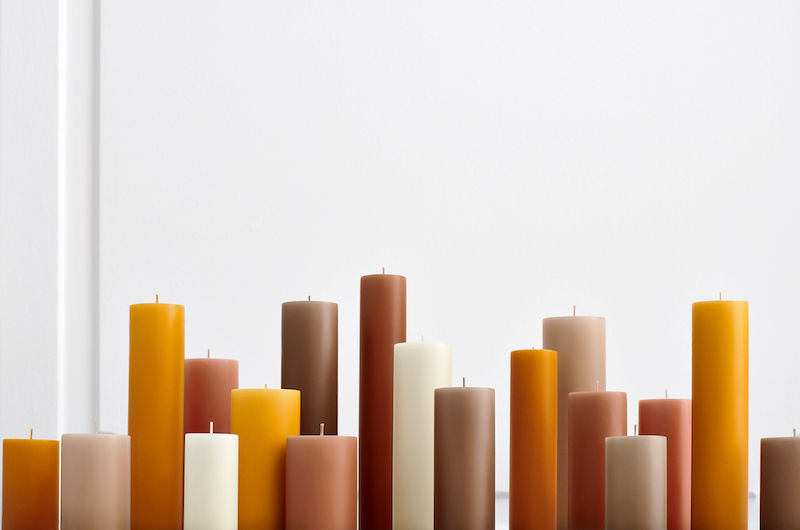
Where is `pink candle`? The height and width of the screenshot is (530, 800). pink candle is located at coordinates (210, 377), (320, 459), (608, 412), (672, 410).